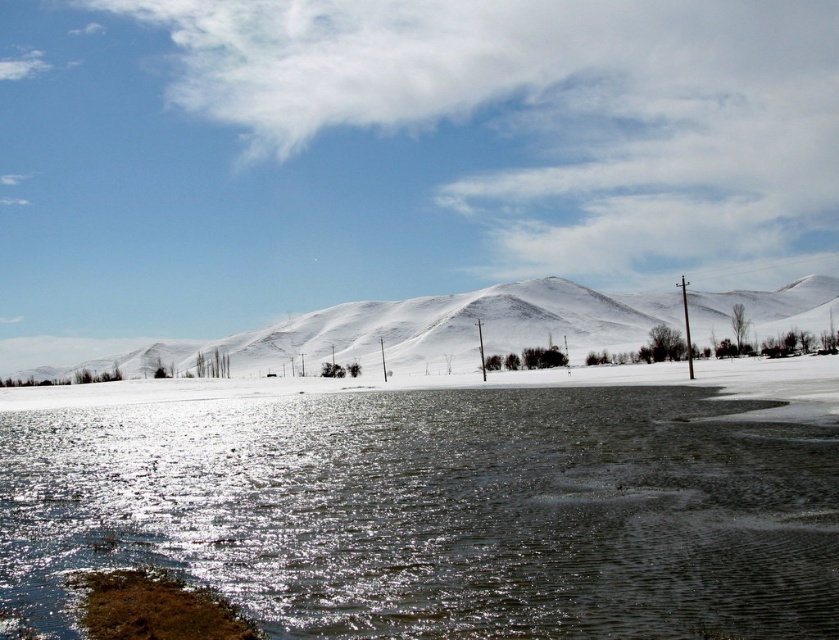
You are standing at the point marked as point (435, 512) in the image. Based on the scene description, what is the terrain like at your current location?

The point (435, 512) corresponds to translucent ice at lower center, so the terrain at this location is translucent ice.